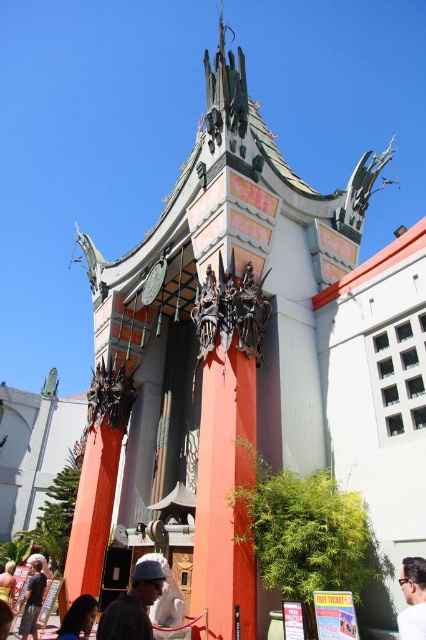
Which is behind, point (420, 632) or point (77, 616)?

The point (77, 616) is behind.

The width and height of the screenshot is (426, 640). Identify the location of brown hair at center. (412, 598).

This screenshot has width=426, height=640. Identify the location of brown hair at center. (412, 598).

Does dark gray shirt at lower left appear under dark brown hair at lower left?

Correct, dark gray shirt at lower left is located below dark brown hair at lower left.

Find the location of `dark gray shirt at lower left`. dark gray shirt at lower left is located at coordinates (32, 600).

Describe the element at coordinates (32, 600) in the screenshot. The image size is (426, 640). I see `dark gray shirt at lower left` at that location.

Locate an element on the screen. The height and width of the screenshot is (640, 426). dark gray shirt at lower left is located at coordinates (32, 600).

Is point (399, 628) in front of point (40, 602)?

Yes, point (399, 628) is in front of point (40, 602).

Identify the location of brown hair at center. The height and width of the screenshot is (640, 426). (412, 598).